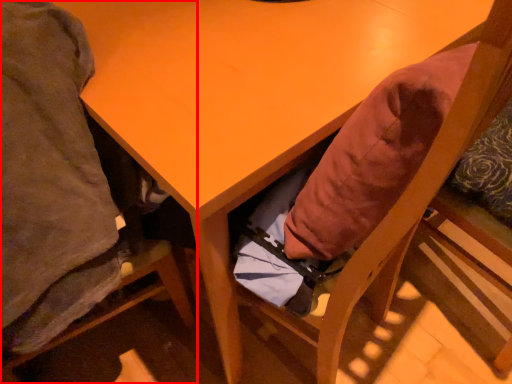
Question: From the image's perspective, what is the correct spatial positioning of chair (annotated by the red box) in reference to chair?

Choices:
 (A) below
 (B) above

Answer: (A)